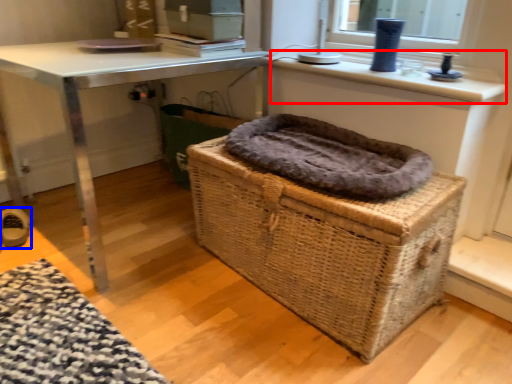
Question: Which of the following is the farthest to the observer, counter top (highlighted by a red box) or shoe (highlighted by a blue box)?

Choices:
 (A) counter top
 (B) shoe

Answer: (B)